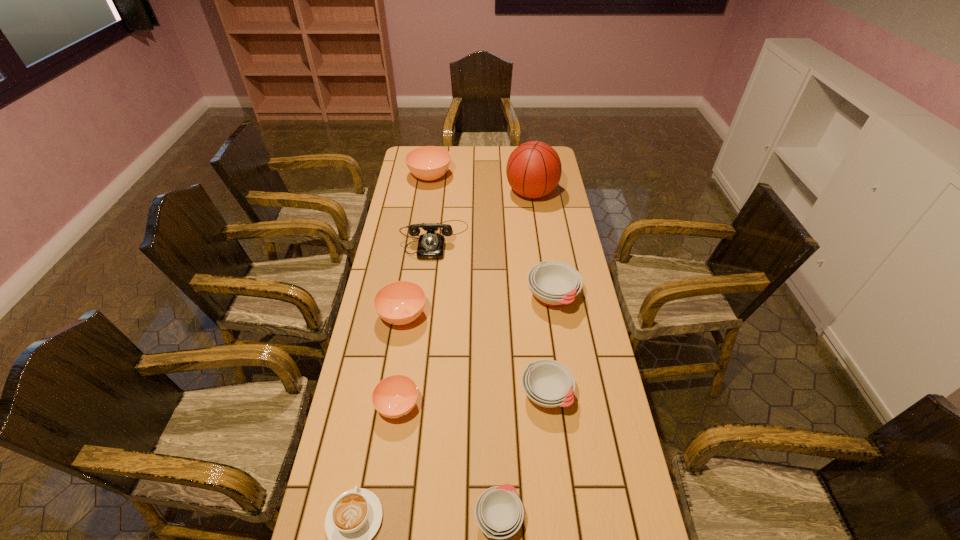
Locate an element on the screen. The height and width of the screenshot is (540, 960). the closest object to the farthest peach soup bowl is located at coordinates (431, 245).

The width and height of the screenshot is (960, 540). I want to click on the second closest soup bowl to the biggest peach soup bowl, so click(399, 303).

Where is `soup bowl that is the closest to the basketball`? soup bowl that is the closest to the basketball is located at coordinates (428, 163).

The width and height of the screenshot is (960, 540). I want to click on the second closest peach soup bowl relative to the nearest peach soup bowl, so click(x=428, y=163).

In order to click on peach soup bowl that is the second closest to the biggest peach soup bowl in this screenshot , I will do `click(395, 396)`.

Locate which white soup bowl is the second closest to the nearest peach soup bowl. Please provide its 2D coordinates. Your answer should be formatted as a tuple, i.e. [(x, y)], where the tuple contains the x and y coordinates of a point satisfying the conditions above.

[(548, 383)]

Select which white soup bowl is the third closest to the tallest object. Please provide its 2D coordinates. Your answer should be formatted as a tuple, i.e. [(x, y)], where the tuple contains the x and y coordinates of a point satisfying the conditions above.

[(499, 513)]

Locate an element on the screen. The image size is (960, 540). vacant space that satisfies the following two spatial constraints: 1. on the front-facing side of the second smallest white soup bowl; 2. on the right side of the third farthest object is located at coordinates (417, 394).